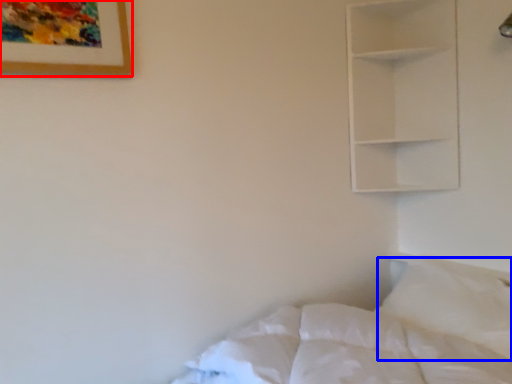
Question: Which object is closer to the camera taking this photo, picture frame (highlighted by a red box) or pillow (highlighted by a blue box)?

Choices:
 (A) picture frame
 (B) pillow

Answer: (A)